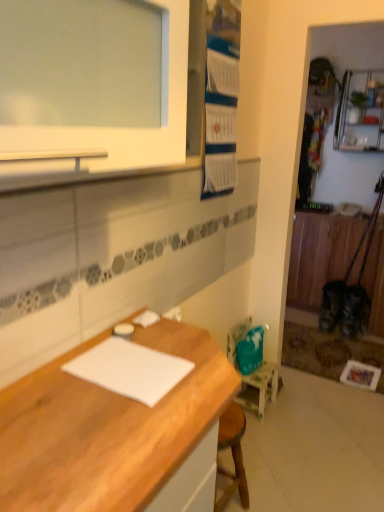
I want to click on free space behind white paper at center, so click(x=158, y=335).